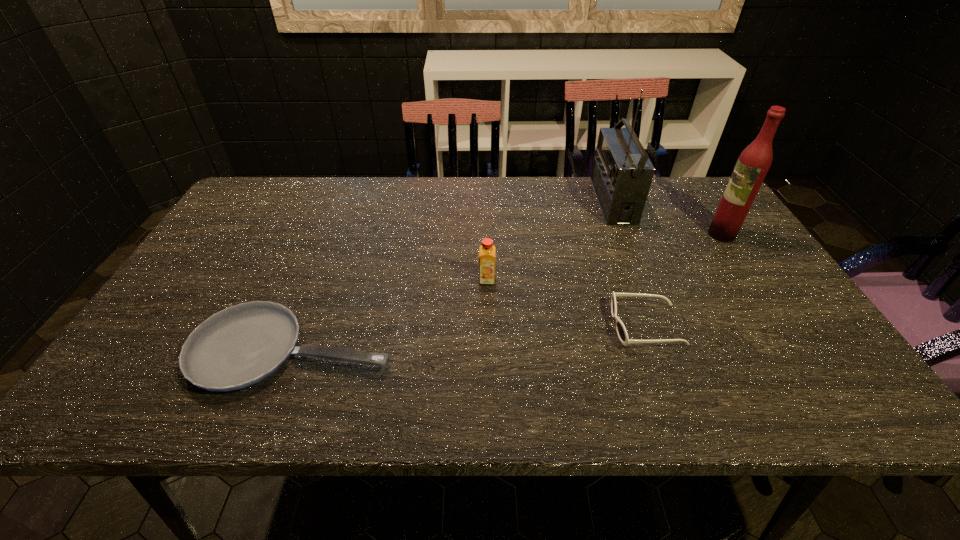
This screenshot has height=540, width=960. What are the coordinates of `radio receiver` in the screenshot? It's located at (622, 173).

Where is `liquor`? liquor is located at coordinates (755, 160).

Find the location of a particular element. The height and width of the screenshot is (540, 960). the rightmost object is located at coordinates (755, 160).

Locate an element on the screen. This screenshot has width=960, height=540. the second object from left to right is located at coordinates (487, 251).

Image resolution: width=960 pixels, height=540 pixels. Find the location of `the third shortest object`. the third shortest object is located at coordinates (487, 251).

This screenshot has height=540, width=960. Find the location of `sunglasses`. sunglasses is located at coordinates (620, 328).

I want to click on frying pan, so click(242, 345).

Find the location of a particular element. This screenshot has height=540, width=960. the shortest object is located at coordinates (242, 345).

Identify the location of free space located 0.300m on the front panel of the radio receiver. (501, 201).

Image resolution: width=960 pixels, height=540 pixels. In order to click on vacant space located on the front panel of the radio receiver in this screenshot , I will do `click(530, 201)`.